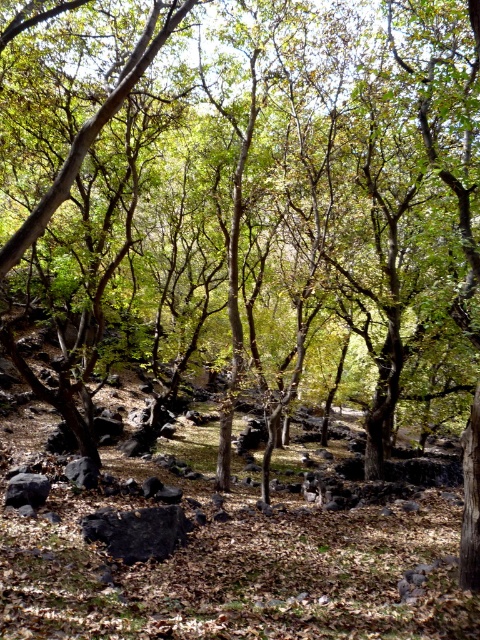
Identify the location of dark gray rock at lower left. The image size is (480, 640). (26, 490).

Which is in front, point (41, 499) or point (69, 476)?

Point (41, 499)

Locate an element on the screen. This screenshot has height=640, width=480. dark gray rock at lower left is located at coordinates (26, 490).

Does black rock at center have a greater height compared to dark gray rock at lower left?

Yes.

Is point (83, 531) in front of point (24, 490)?

Yes, it is.

Is point (145, 552) closer to camera compared to point (31, 499)?

That is True.

Identify the location of black rock at center. The width and height of the screenshot is (480, 640). (137, 531).

Between black rock at center and black smooth rock at lower left, which one appears on the left side from the viewer's perspective?

black smooth rock at lower left

Can you confirm if black rock at center is taller than black smooth rock at lower left?

Yes, black rock at center is taller than black smooth rock at lower left.

Locate an element on the screen. black rock at center is located at coordinates (137, 531).